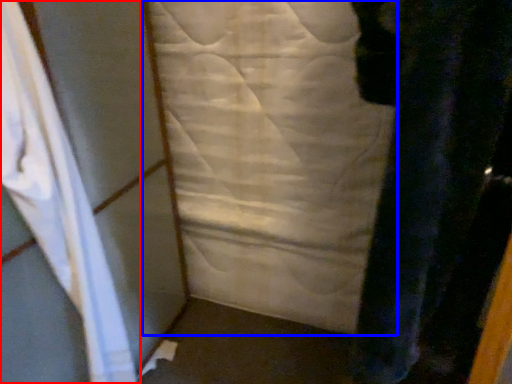
Question: Which object appears closest to the camera in this image, curtain (highlighted by a red box) or sheet (highlighted by a blue box)?

Choices:
 (A) curtain
 (B) sheet

Answer: (A)